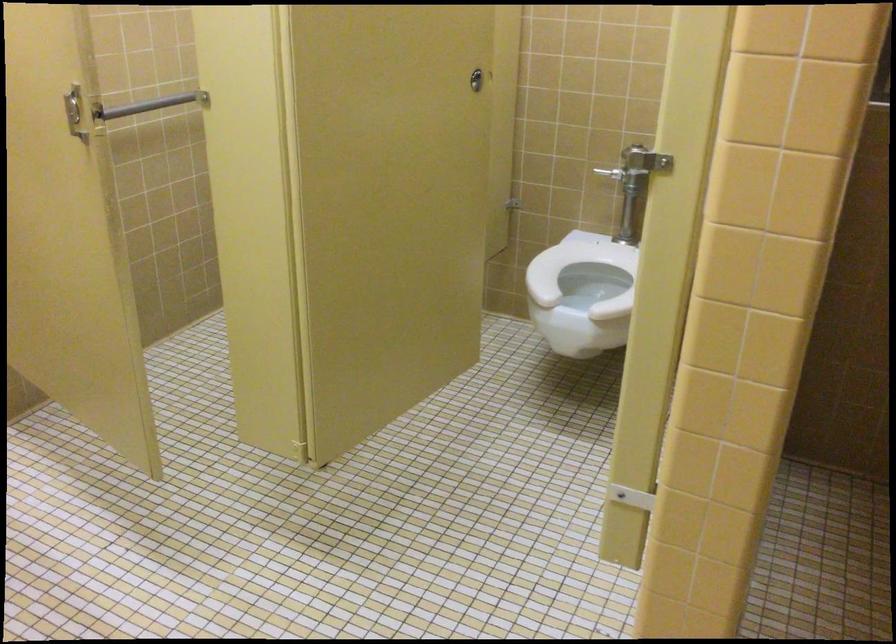
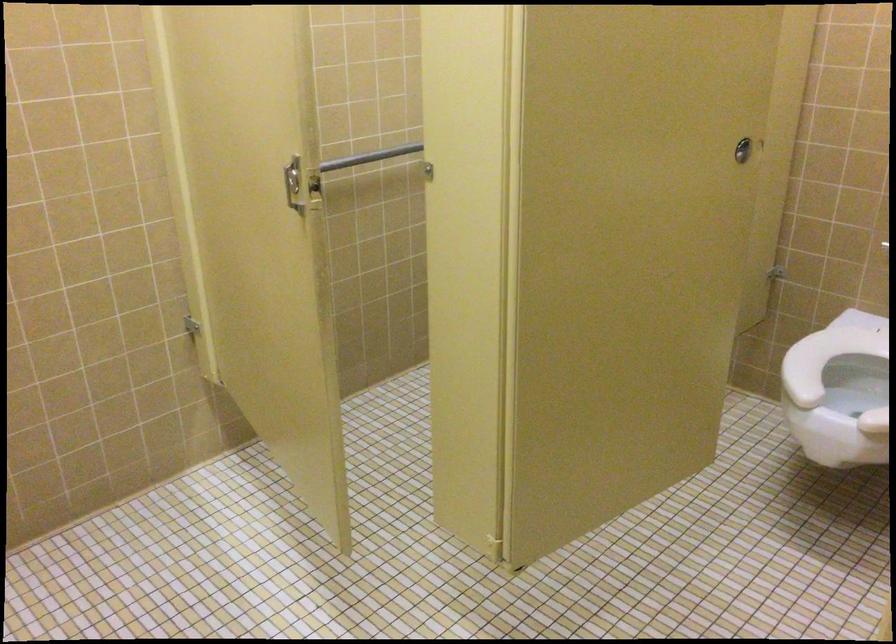
Question: The camera is either moving clockwise (left) or counter-clockwise (right) around the object. The first image is from the beginning of the video and the second image is from the end. Is the camera moving left or right when shooting the video?

Choices:
 (A) Left
 (B) Right

Answer: (B)